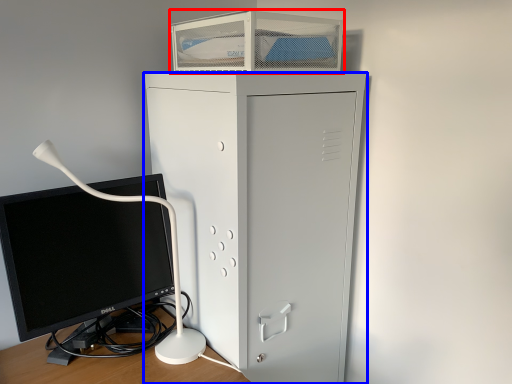
Question: Which object is closer to the camera taking this photo, desktop (highlighted by a red box) or furniture (highlighted by a blue box)?

Choices:
 (A) desktop
 (B) furniture

Answer: (B)